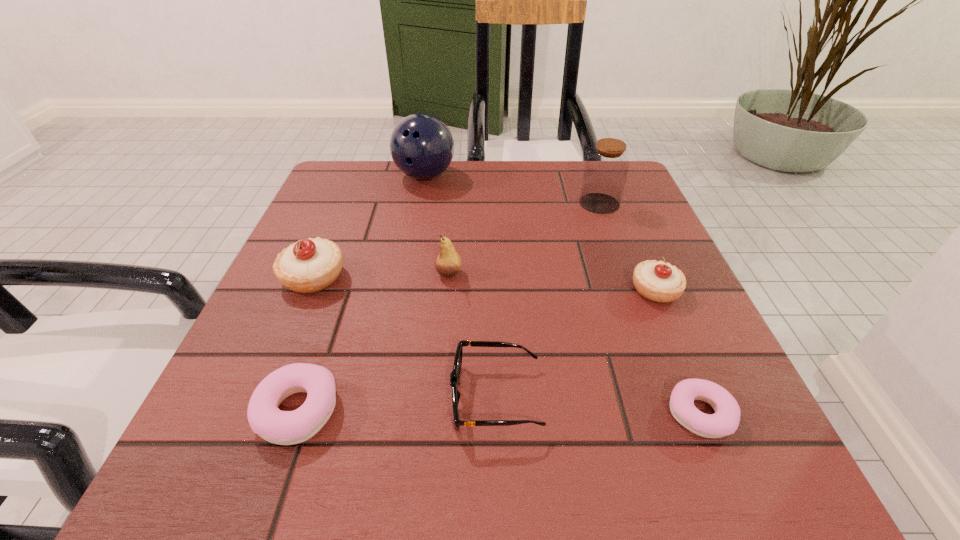
You are a GUI agent. You are given a task and a screenshot of the screen. Output one action in this format:
    pyautogui.click(x=<x>, y=<y>)
    Task: Click on the bowling ball
    The width and height of the screenshot is (960, 540).
    Given the screenshot: What is the action you would take?
    pyautogui.click(x=421, y=145)

Where is `blue bowling ball`? This screenshot has height=540, width=960. blue bowling ball is located at coordinates (421, 145).

The width and height of the screenshot is (960, 540). Identify the location of the second farthest object. (606, 169).

Identify the location of jar. Image resolution: width=960 pixels, height=540 pixels. pos(606,169).

Locate an element on the screen. The width and height of the screenshot is (960, 540). the third tallest object is located at coordinates (448, 263).

Locate an element on the screen. the bigger beige pastry is located at coordinates (310, 265).

Find the location of a particular element. The height and width of the screenshot is (540, 960). the left beige pastry is located at coordinates (310, 265).

This screenshot has width=960, height=540. Identify the location of the third shortest pastry. (657, 281).

Image resolution: width=960 pixels, height=540 pixels. I want to click on the right beige pastry, so [657, 281].

Locate an element on the screen. sunglasses is located at coordinates (455, 374).